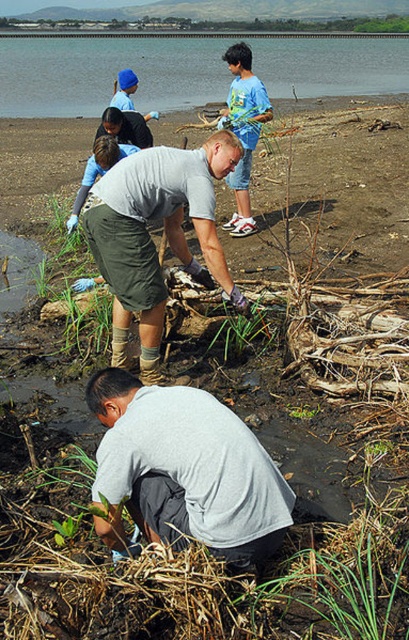
Question: Can you confirm if gray matte shorts at center is wider than green grass at center?

Choices:
 (A) no
 (B) yes

Answer: (B)

Question: Which object is the closest to the gray matte shirt at lower center?

Choices:
 (A) clear water at upper center
 (B) green grass at center
 (C) blue cotton shirt at upper center

Answer: (B)

Question: Estimate the real-world distances between objects in this image. Which object is farther from the green grass at center?

Choices:
 (A) gray matte shorts at center
 (B) gray matte shirt at lower center
 (C) blue cotton shirt at upper center
 (D) clear water at upper center

Answer: (D)

Question: Which point is closer to the camera?

Choices:
 (A) blue cotton shirt at upper center
 (B) gray matte shirt at lower center
 (C) clear water at upper center
 (D) gray matte shorts at center

Answer: (B)

Question: Does gray matte shirt at lower center appear on the left side of gray matte shorts at center?

Choices:
 (A) yes
 (B) no

Answer: (B)

Question: Can you confirm if clear water at upper center is positioned above green grass at center?

Choices:
 (A) no
 (B) yes

Answer: (B)